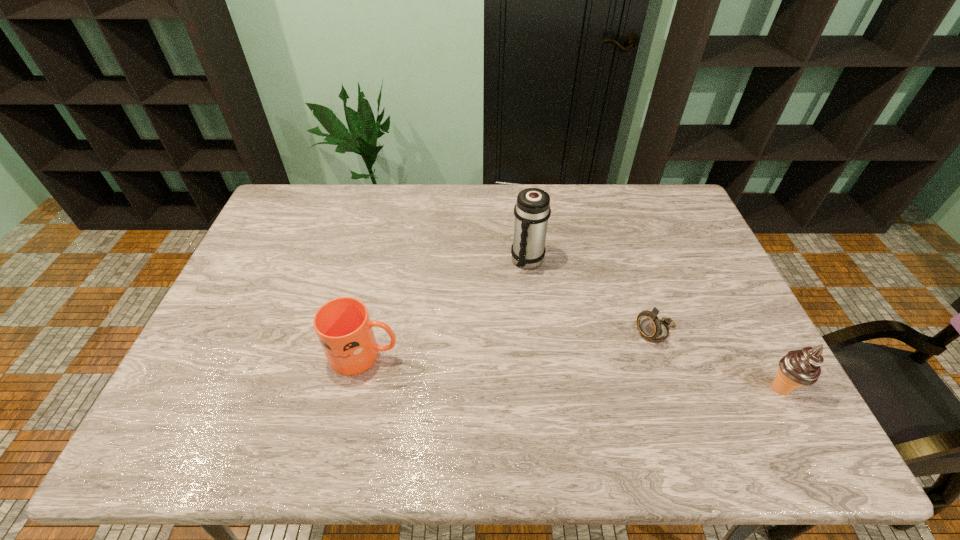
This screenshot has width=960, height=540. Find the location of `blank area located on the face of the second object from right to left`. blank area located on the face of the second object from right to left is located at coordinates (556, 383).

Image resolution: width=960 pixels, height=540 pixels. In order to click on vacant point located on the side with the handle of the third object from right to left in this screenshot , I will do `click(517, 329)`.

Where is `free region located on the side with the handle of the third object from right to left`? The width and height of the screenshot is (960, 540). free region located on the side with the handle of the third object from right to left is located at coordinates (516, 332).

At what (x,y) coordinates should I click in order to perform the action: click on free region located 0.200m on the side with the handle of the third object from right to left. Please return your answer as a coordinate pair (x, y). This screenshot has width=960, height=540. Looking at the image, I should click on (517, 326).

In order to click on mug at the near edge in this screenshot , I will do `click(343, 326)`.

Identify the location of icecream situated at the near edge. (801, 367).

Where is `object located at the right edge`? This screenshot has width=960, height=540. object located at the right edge is located at coordinates (801, 367).

In order to click on object that is at the near right corner in this screenshot , I will do `click(801, 367)`.

Where is `vacant region at the far edge of the desktop`? Image resolution: width=960 pixels, height=540 pixels. vacant region at the far edge of the desktop is located at coordinates (508, 199).

At what (x,y) coordinates should I click in order to perform the action: click on vacant position at the near edge of the desktop. Please return your answer as a coordinate pair (x, y). Image resolution: width=960 pixels, height=540 pixels. Looking at the image, I should click on (685, 394).